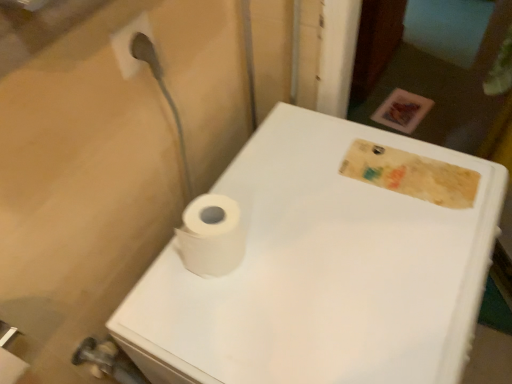
Locate an element on the screen. This screenshot has width=512, height=384. free space in front of white matte toilet paper at center is located at coordinates (231, 327).